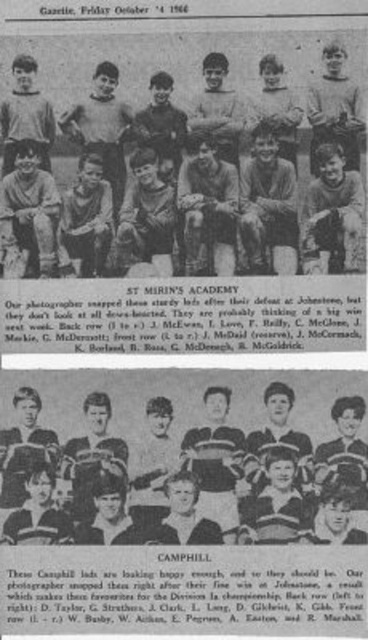
Question: Which point is farther to the camera?

Choices:
 (A) matte gray uniforms at center
 (B) striped jersey baseball team at lower center

Answer: (A)

Question: Can you confirm if matte gray uniforms at center is thinner than striped jersey baseball team at lower center?

Choices:
 (A) no
 (B) yes

Answer: (A)

Question: Considering the relative positions of matte gray uniforms at center and striped jersey baseball team at lower center in the image provided, where is matte gray uniforms at center located with respect to striped jersey baseball team at lower center?

Choices:
 (A) right
 (B) left

Answer: (B)

Question: Does matte gray uniforms at center come in front of striped jersey baseball team at lower center?

Choices:
 (A) no
 (B) yes

Answer: (A)

Question: Among these objects, which one is farthest from the camera?

Choices:
 (A) striped jersey baseball team at lower center
 (B) matte gray uniforms at center

Answer: (B)

Question: Which object is closer to the camera taking this photo?

Choices:
 (A) matte gray uniforms at center
 (B) striped jersey baseball team at lower center

Answer: (B)